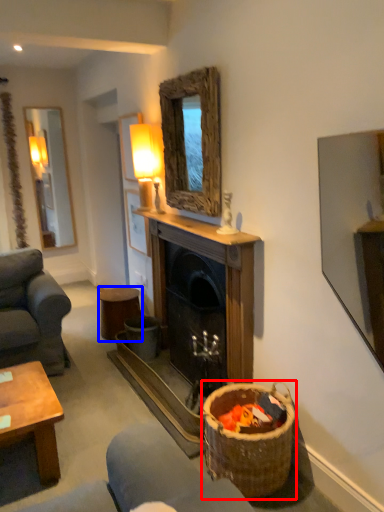
Question: Which object is closer to the camera taking this photo, basket (highlighted by a red box) or stool (highlighted by a blue box)?

Choices:
 (A) basket
 (B) stool

Answer: (A)